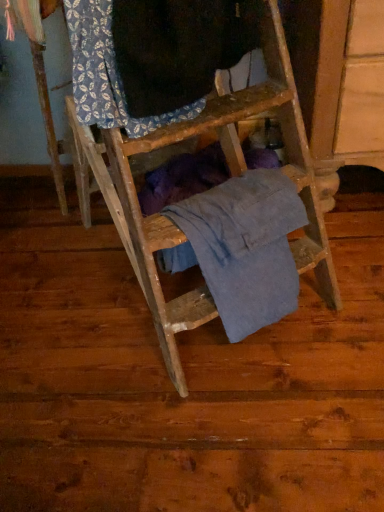
Question: In terms of size, does blue printed fabric at upper left, which is the 1th clothing from top to bottom, appear bigger or smaller than blue cotton shirt at center, the 1th clothing from the bottom?

Choices:
 (A) small
 (B) big

Answer: (B)

Question: In terms of width, does blue printed fabric at upper left, which is the 1th clothing from top to bottom, look wider or thinner when compared to blue cotton shirt at center, the second clothing when ordered from top to bottom?

Choices:
 (A) thin
 (B) wide

Answer: (B)

Question: Considering their positions, is blue printed fabric at upper left, placed as the 2th clothing when sorted from bottom to top, located in front of or behind blue cotton shirt at center, the second clothing when ordered from top to bottom?

Choices:
 (A) front
 (B) behind

Answer: (A)

Question: Considering the positions of blue cotton shirt at center, the second clothing when ordered from top to bottom, and blue printed fabric at upper left, which is the 1th clothing from top to bottom, in the image, is blue cotton shirt at center, the second clothing when ordered from top to bottom, bigger or smaller than blue printed fabric at upper left, which is the 1th clothing from top to bottom,?

Choices:
 (A) small
 (B) big

Answer: (A)

Question: Relative to blue printed fabric at upper left, placed as the 2th clothing when sorted from bottom to top, is blue cotton shirt at center, the second clothing when ordered from top to bottom, in front or behind?

Choices:
 (A) front
 (B) behind

Answer: (B)

Question: From the image's perspective, relative to blue printed fabric at upper left, placed as the 2th clothing when sorted from bottom to top, is blue cotton shirt at center, the second clothing when ordered from top to bottom, above or below?

Choices:
 (A) above
 (B) below

Answer: (B)

Question: Is blue cotton shirt at center, the 1th clothing from the bottom, wider or thinner than blue printed fabric at upper left, placed as the 2th clothing when sorted from bottom to top?

Choices:
 (A) thin
 (B) wide

Answer: (A)